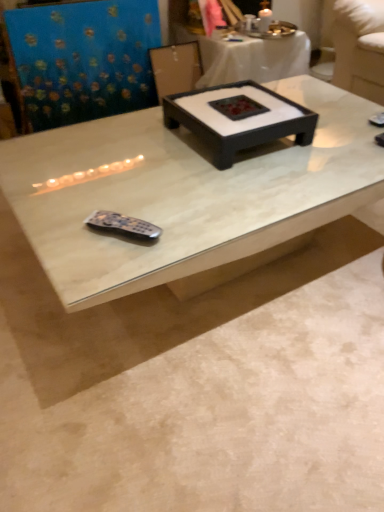
At what (x,y) coordinates should I click in order to perform the action: click on vacant space to the right of black matte tray at center, which ranks as the 2th coffee table in left-to-right order. Please return your answer as a coordinate pair (x, y). This screenshot has height=512, width=384. Looking at the image, I should click on (338, 143).